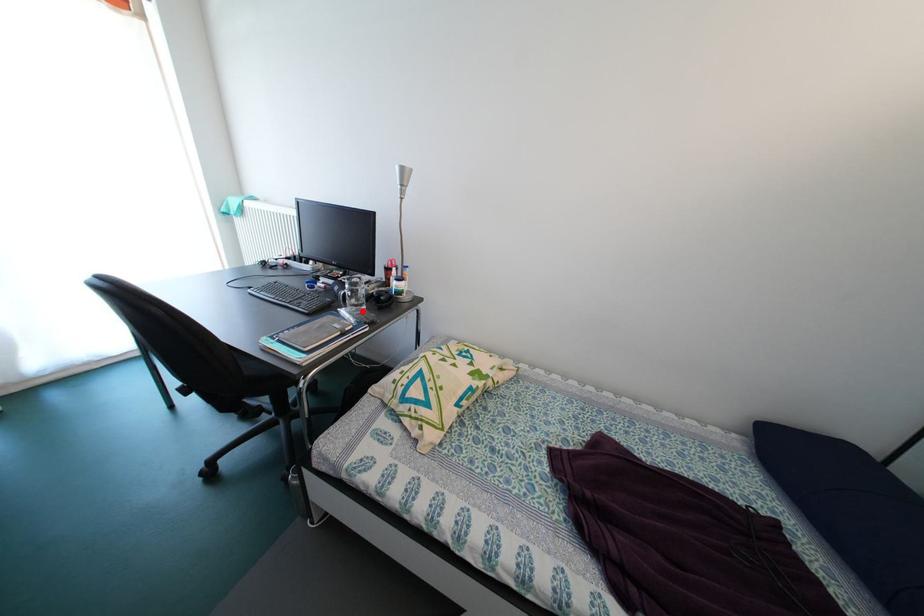
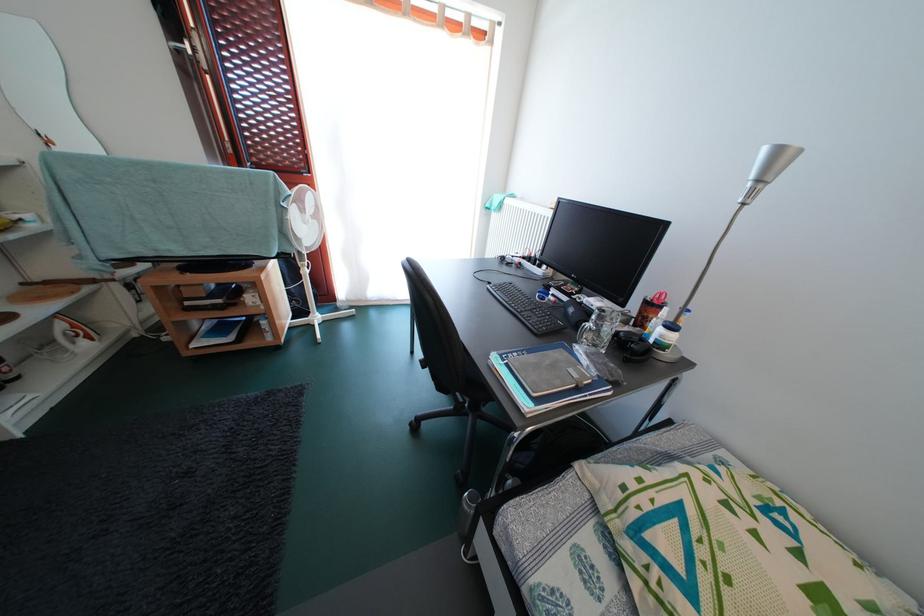
Question: I am providing you with two images of the same scene from different viewpoints. A red point is marked on the first image. At the location where the point appears in image 1, is it still visible in image 2?

Choices:
 (A) Yes
 (B) No

Answer: (A)